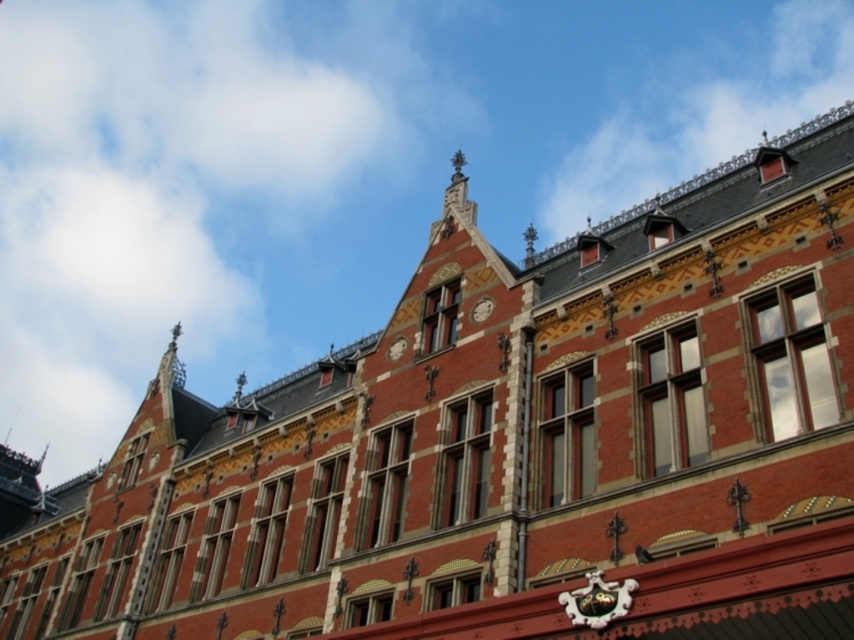
You are an architect examining the grand historic building. You notice two clocks on the roof, the matte red clock at center and the matte gray clock at center. Which clock is shorter in height?

The matte red clock at center is shorter in height compared to the matte gray clock at center.

You are standing in front of a historic building with a red brick facade. You notice a point marked at coordinates (481, 308). What is located at that point?

The point at coordinates (481, 308) marks the location of the matte red clock at center.

You are standing in front of the historic building and notice two points marked on the facade. The first point is at coordinates point (486,308) and the second is at point (393,340). Which point is closer to your current position?

Point (486,308) is closer to the camera than point (393,340), so the first point is closer to your current position.